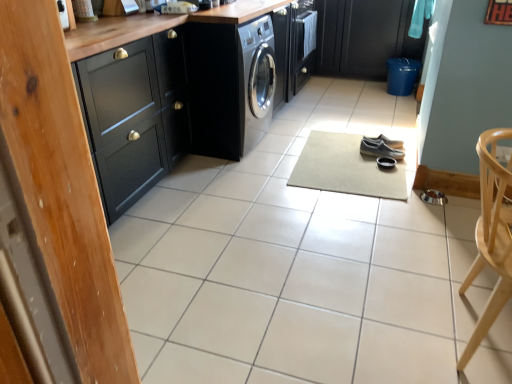
Locate an element on the screen. unoccupied space behind black leather shoes at center, which is counted as the 2th footwear, starting from the front is located at coordinates (374, 134).